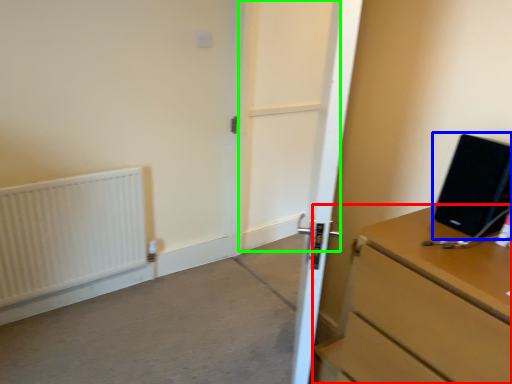
Question: Estimate the real-world distances between objects in this image. Which object is farther from chest of drawers (highlighted by a red box), desktop computer (highlighted by a blue box) or screen door (highlighted by a green box)?

Choices:
 (A) desktop computer
 (B) screen door

Answer: (B)